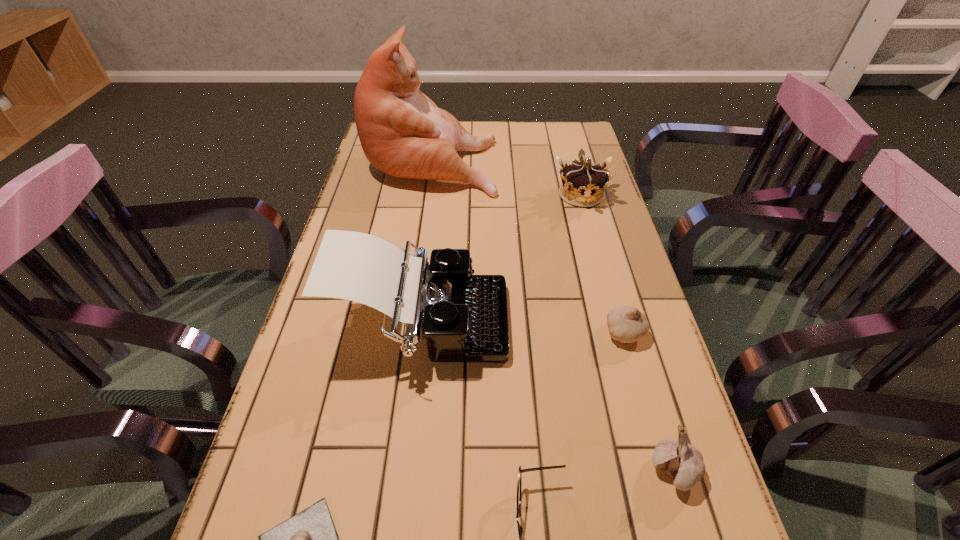
Locate an element on the screen. This screenshot has height=540, width=960. blank space located 0.060m on the front of the fourth tallest object is located at coordinates (693, 536).

Where is `vacant region located 0.300m on the front of the farthest garlic`? This screenshot has height=540, width=960. vacant region located 0.300m on the front of the farthest garlic is located at coordinates (670, 494).

Find the location of a particular element. The image size is (960, 540). object located in the far edge section of the desktop is located at coordinates (402, 132).

At what (x,y) coordinates should I click in order to perform the action: click on cat positioned at the left edge. Please return your answer as a coordinate pair (x, y). The height and width of the screenshot is (540, 960). Looking at the image, I should click on (402, 132).

You are a GUI agent. You are given a task and a screenshot of the screen. Output one action in this format:
    pyautogui.click(x=<x>, y=<y>)
    Task: Click on the typewriter positioned at the left edge
    This screenshot has height=540, width=960.
    Given the screenshot: What is the action you would take?
    pyautogui.click(x=464, y=318)

Where is `crown present at the right edge`? This screenshot has height=540, width=960. crown present at the right edge is located at coordinates (582, 184).

Where is `object present at the far left corner`? The height and width of the screenshot is (540, 960). object present at the far left corner is located at coordinates (402, 132).

Identify the location of vacant space at the far edge. The height and width of the screenshot is (540, 960). (541, 152).

In the image, there is a desktop. Find the location of `free space at the left edge`. free space at the left edge is located at coordinates (381, 178).

Image resolution: width=960 pixels, height=540 pixels. I want to click on free spot between the typewriter and the fifth shortest object, so click(x=501, y=259).